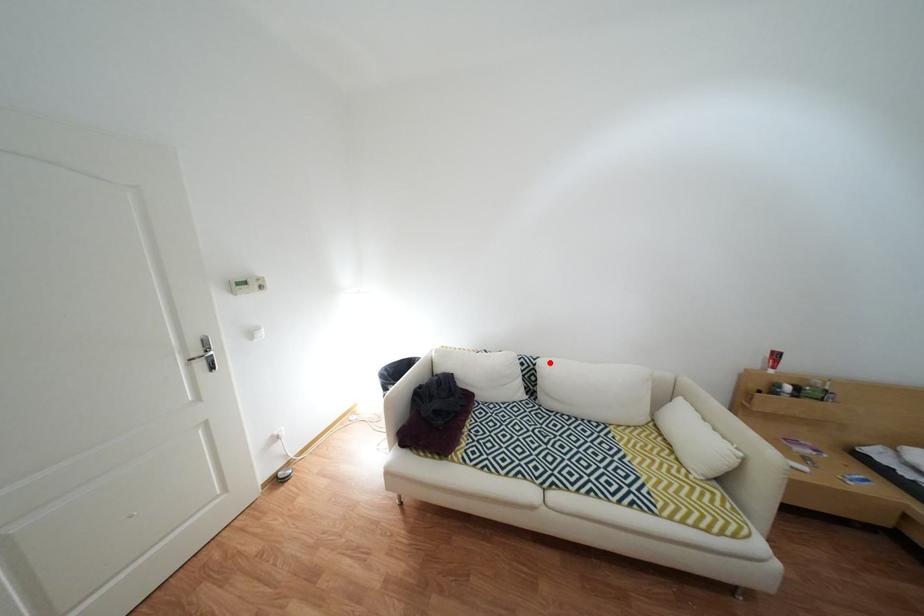
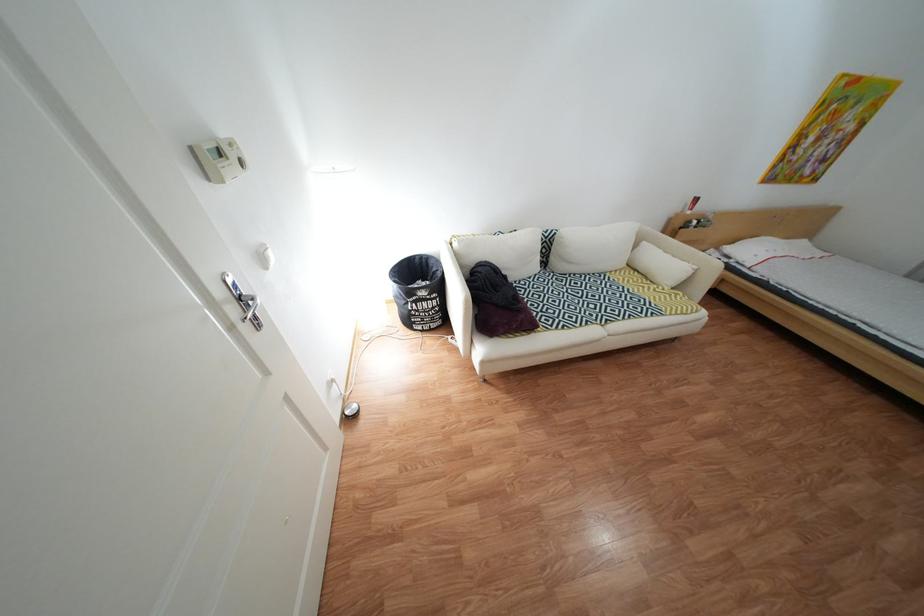
The point at the highlighted location is marked in the first image. Where is the corresponding point in the second image?

(562, 236)